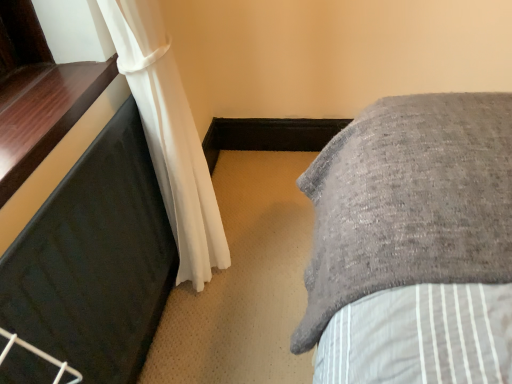
Question: From a real-world perspective, relative to black rubber mat at left, is black glossy window sill at left vertically above or below?

Choices:
 (A) below
 (B) above

Answer: (B)

Question: Is black glossy window sill at left in front of or behind black rubber mat at left in the image?

Choices:
 (A) behind
 (B) front

Answer: (A)

Question: Which object is positioned farthest from the black rubber mat at left?

Choices:
 (A) white sheer curtain at left
 (B) black glossy window sill at left

Answer: (A)

Question: Estimate the real-world distances between objects in this image. Which object is closer to the black glossy window sill at left?

Choices:
 (A) white sheer curtain at left
 (B) black rubber mat at left

Answer: (B)